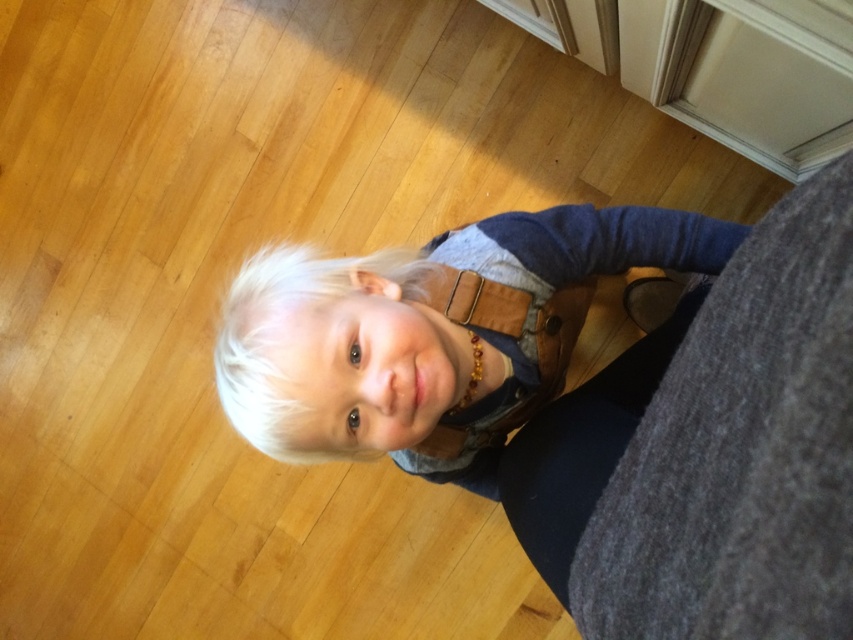
Question: Estimate the real-world distances between objects in this image. Which object is farther from the blonde hair at center?

Choices:
 (A) matte brown leather bag at center
 (B) brown leather belt at center

Answer: (B)

Question: Does matte brown leather bag at center lie in front of blonde hair at center?

Choices:
 (A) yes
 (B) no

Answer: (A)

Question: Observing the image, what is the correct spatial positioning of matte brown leather bag at center in reference to brown leather belt at center?

Choices:
 (A) above
 (B) below

Answer: (B)

Question: Among these objects, which one is farthest from the camera?

Choices:
 (A) blonde hair at center
 (B) matte brown leather bag at center
 (C) brown leather belt at center

Answer: (C)

Question: Which is nearer to the brown leather belt at center?

Choices:
 (A) matte brown leather bag at center
 (B) blonde hair at center

Answer: (B)

Question: Considering the relative positions of matte brown leather bag at center and blonde hair at center in the image provided, where is matte brown leather bag at center located with respect to blonde hair at center?

Choices:
 (A) below
 (B) above

Answer: (A)